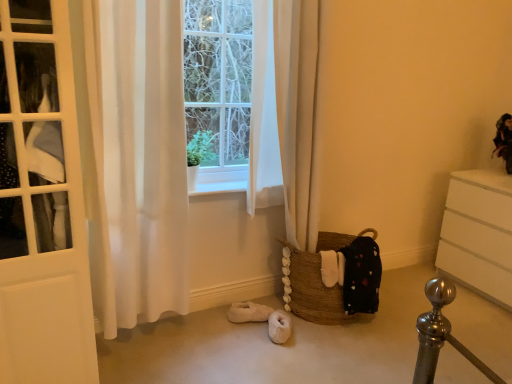
The height and width of the screenshot is (384, 512). Find the location of `free space in front of brown woven basket at lower center`. free space in front of brown woven basket at lower center is located at coordinates (339, 355).